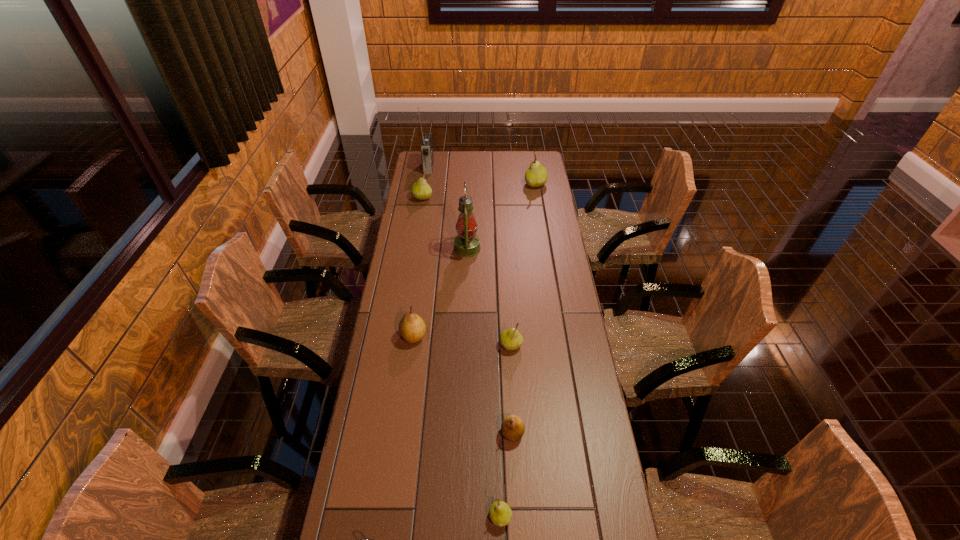
Locate an element on the screen. the farthest object is located at coordinates (426, 146).

Locate an element on the screen. The image size is (960, 540). green oil lamp is located at coordinates (466, 244).

Locate an element on the screen. oil lamp is located at coordinates (466, 244).

I want to click on the farthest pear, so click(536, 175).

The height and width of the screenshot is (540, 960). Find the location of `the third tallest object`. the third tallest object is located at coordinates (536, 175).

In order to click on the sixth shortest object in this screenshot , I will do `click(421, 190)`.

At what (x,y) coordinates should I click in order to perform the action: click on the third nearest green pear. Please return your answer as a coordinate pair (x, y). The image size is (960, 540). Looking at the image, I should click on (421, 190).

Identify the location of the third farthest green pear. (510, 339).

This screenshot has width=960, height=540. Identify the location of the bigger brown pear. (412, 328).

Identify the location of the farther brown pear. (412, 328).